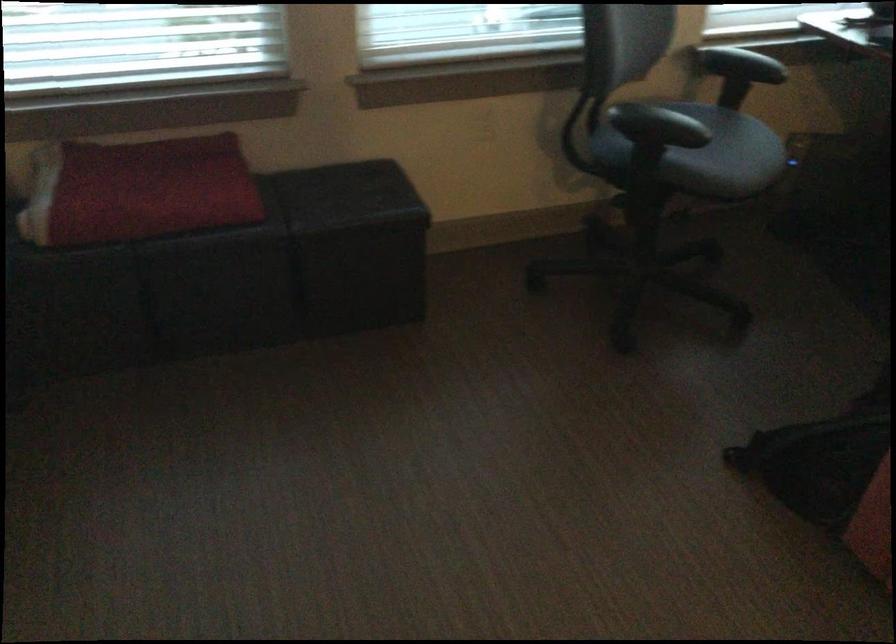
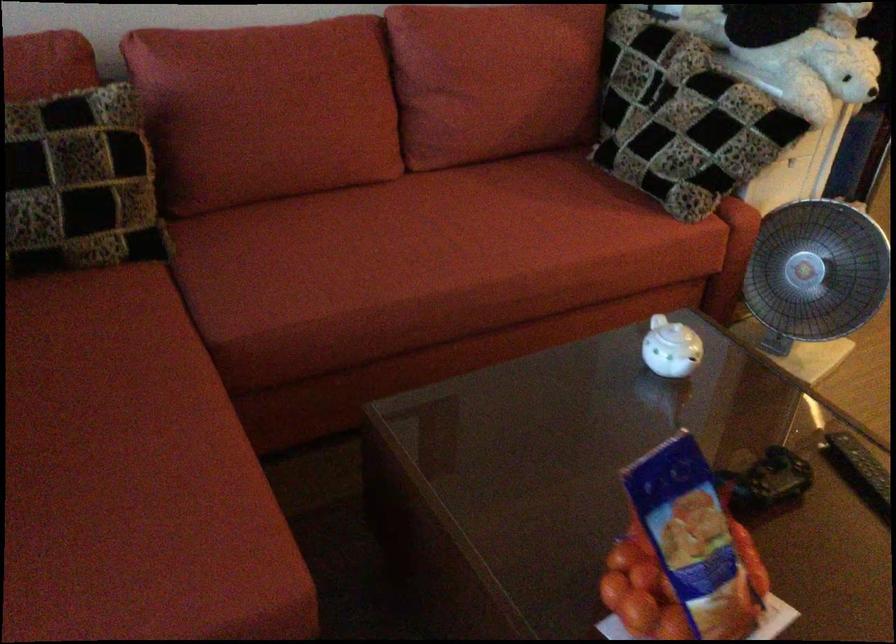
First-person continuous shooting, in which direction is the camera rotating?

The rotation direction of the camera is right-down.